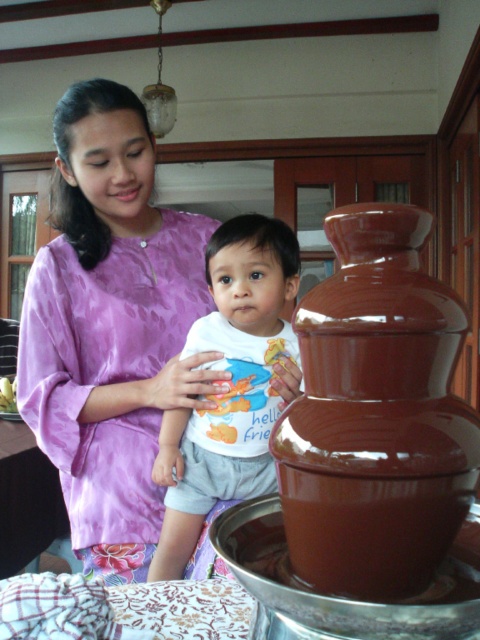
Question: Which object is closer to the camera taking this photo?

Choices:
 (A) purple satin dress at upper left
 (B) shiny brown chocolate fountain at right

Answer: (B)

Question: In this image, where is purple satin dress at upper left located relative to white cotton shirt at center?

Choices:
 (A) right
 (B) left

Answer: (B)

Question: Does purple satin dress at upper left appear under white cotton shirt at center?

Choices:
 (A) yes
 (B) no

Answer: (B)

Question: Can you confirm if purple satin dress at upper left is smaller than white cotton shirt at center?

Choices:
 (A) no
 (B) yes

Answer: (A)

Question: Which object appears farthest from the camera in this image?

Choices:
 (A) white cotton shirt at center
 (B) shiny brown chocolate fountain at right

Answer: (A)

Question: Considering the real-world distances, which object is closest to the shiny brown chocolate fountain at right?

Choices:
 (A) purple satin dress at upper left
 (B) white cotton shirt at center

Answer: (B)